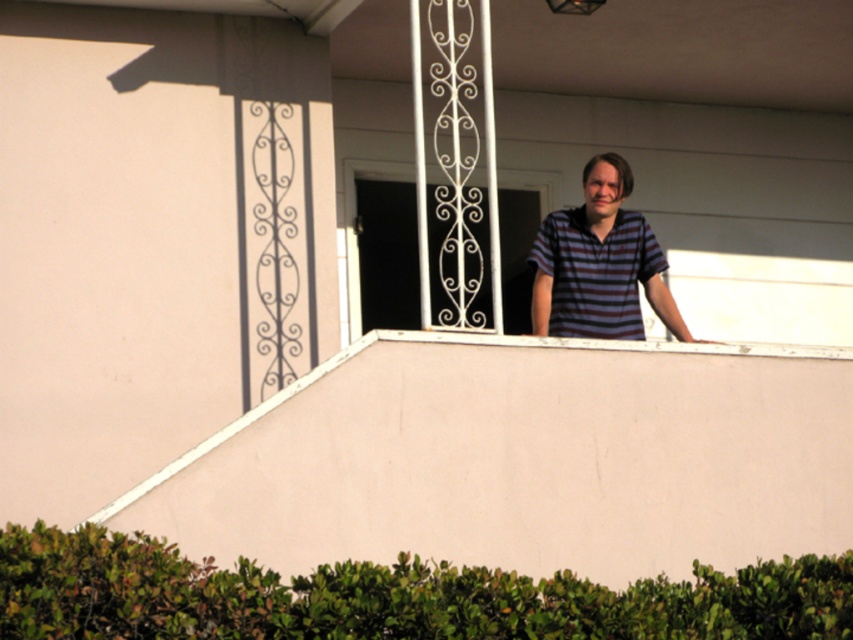
Question: Estimate the real-world distances between objects in this image. Which object is closer to the striped cotton shirt at upper center?

Choices:
 (A) white wrought iron at upper center
 (B) pink matte balcony at upper center

Answer: (B)

Question: Does pink matte balcony at upper center have a greater width compared to striped cotton shirt at upper center?

Choices:
 (A) yes
 (B) no

Answer: (A)

Question: Which of these objects is positioned closest to the white wrought iron at upper center?

Choices:
 (A) striped cotton shirt at upper center
 (B) pink matte balcony at upper center

Answer: (A)

Question: Which of the following is the closest to the observer?

Choices:
 (A) (643, 266)
 (B) (844, 461)
 (C) (393, 164)

Answer: (B)

Question: Considering the relative positions of striped cotton shirt at upper center and white wrought iron at upper center in the image provided, where is striped cotton shirt at upper center located with respect to white wrought iron at upper center?

Choices:
 (A) left
 (B) right

Answer: (B)

Question: Does pink matte balcony at upper center appear on the right side of white wrought iron at upper center?

Choices:
 (A) yes
 (B) no

Answer: (A)